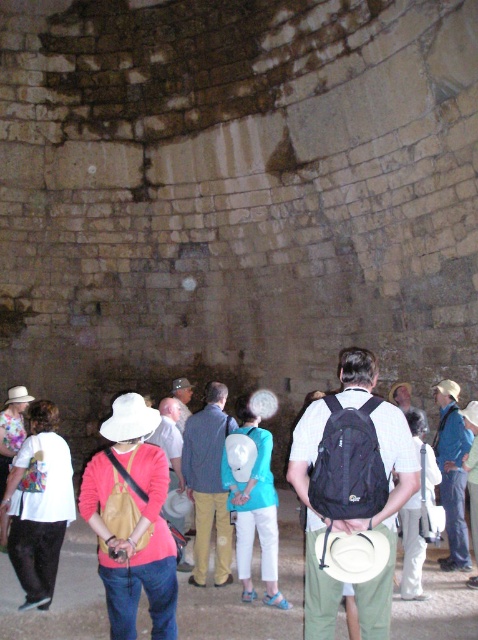
From the picture: Which of these two, blue denim shirt at center or blue fabric backpack at center, stands taller?

With more height is blue denim shirt at center.

Can you confirm if blue denim shirt at center is shorter than blue fabric backpack at center?

No.

Which is behind, point (199, 451) or point (443, 465)?

The point (443, 465) is behind.

Locate an element on the screen. blue denim shirt at center is located at coordinates (207, 484).

Does blue fabric backpack at center lie in front of matte black backpack at center?

No, it is behind matte black backpack at center.

Can you confirm if blue fabric backpack at center is bigger than matte black backpack at center?

Yes.

Identify the location of blue fabric backpack at center. (452, 472).

Is matte yellow backpack at center closer to camera compared to matte yellow bag at center?

Yes, matte yellow backpack at center is in front of matte yellow bag at center.

From the picture: Can you confirm if matte yellow backpack at center is positioned above matte yellow bag at center?

Actually, matte yellow backpack at center is below matte yellow bag at center.

What do you see at coordinates (254, 600) in the screenshot? I see `matte yellow backpack at center` at bounding box center [254, 600].

The image size is (478, 640). Find the location of `matte yellow backpack at center`. matte yellow backpack at center is located at coordinates (254, 600).